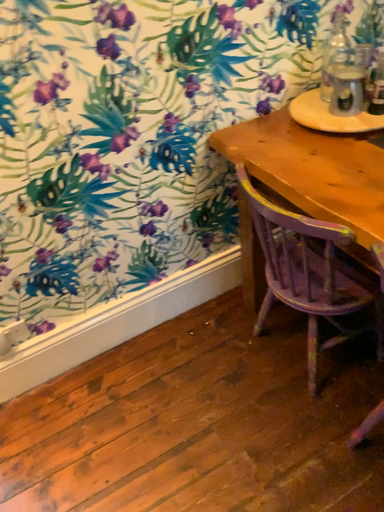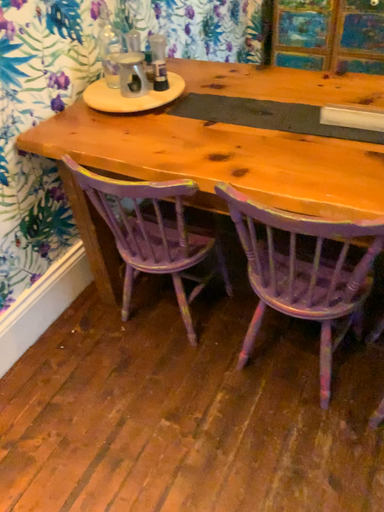
Question: How did the camera likely rotate when shooting the video?

Choices:
 (A) rotated left
 (B) rotated right

Answer: (B)